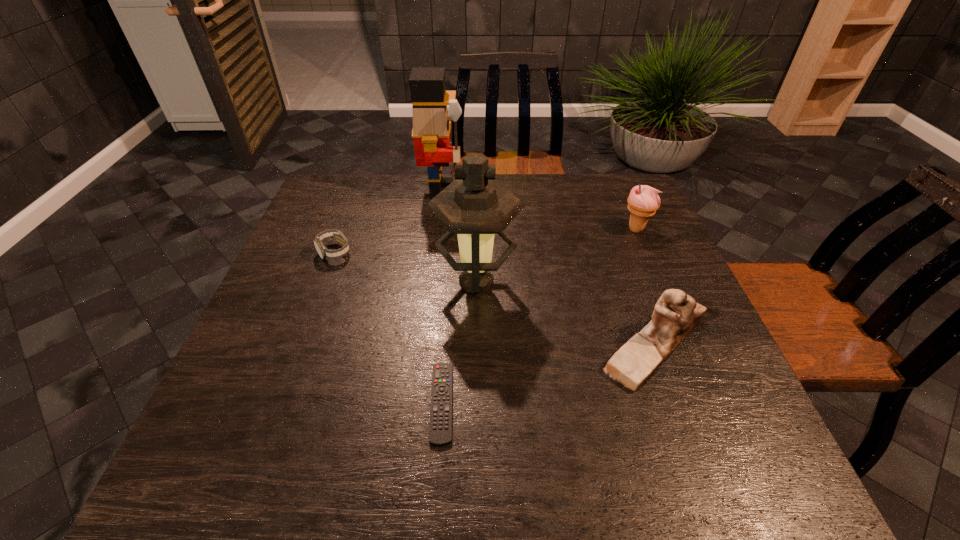
The height and width of the screenshot is (540, 960). I want to click on free space at the far edge of the desktop, so click(557, 189).

This screenshot has height=540, width=960. I want to click on free space at the near edge of the desktop, so click(478, 478).

At what (x,y) coordinates should I click in order to perform the action: click on vacant space at the left edge. Please return your answer as a coordinate pair (x, y). Looking at the image, I should click on (323, 220).

Locate an element on the screen. The image size is (960, 540). vacant space at the right edge of the desktop is located at coordinates (636, 325).

Identify the location of free region at the far left corner of the desktop. (314, 212).

Identify the location of blank area at the far right corner. (591, 187).

You are a GUI agent. You are given a task and a screenshot of the screen. Output one action in this format:
    pyautogui.click(x=<x>, y=<y>)
    Task: Click on the free spot between the icecream and the figurine
    The image size is (960, 540).
    Given the screenshot: What is the action you would take?
    pyautogui.click(x=645, y=287)

At what (x,y) coordinates should I click in order to perform the action: click on free spot between the shortest object and the figurine. Please return your answer as a coordinate pair (x, y). The width and height of the screenshot is (960, 540). Looking at the image, I should click on (548, 374).

What are the coordinates of `vacant area that lies between the nutcracker and the shortest object` in the screenshot? It's located at (442, 297).

Identify the location of vacant space that is in between the oil lamp and the leftmost object. (405, 267).